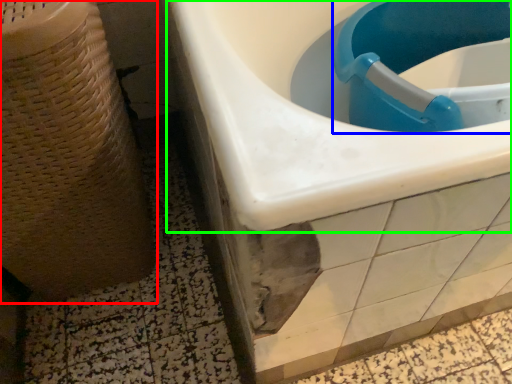
Question: Which is farther away from potty (highlighted by a red box)? sink (highlighted by a blue box) or sink (highlighted by a green box)?

Choices:
 (A) sink
 (B) sink

Answer: (A)